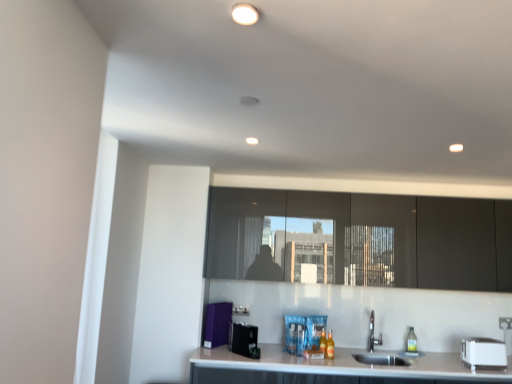
Question: Looking at their shapes, would you say matte black cabinets at center is wider or thinner than white plastic toaster at lower right, arranged as the 3th appliance when viewed from the left?

Choices:
 (A) wide
 (B) thin

Answer: (A)

Question: In terms of size, does matte black cabinets at center appear bigger or smaller than white plastic toaster at lower right, arranged as the 3th appliance when viewed from the left?

Choices:
 (A) small
 (B) big

Answer: (B)

Question: Estimate the real-world distances between objects in this image. Which object is farther from the translucent plastic bottle at lower center, the first bottle positioned from the back?

Choices:
 (A) translucent glass bottle at lower center, placed as the 1th bottle when sorted from front to back
 (B) purple fabric at lower center, marked as the third appliance in a right-to-left arrangement
 (C) black plastic coffee machine at center, positioned as the 2th appliance in right-to-left order
 (D) translucent plastic bottle at sink right
 (E) white plastic toaster at lower right, the 1th appliance when ordered from right to left

Answer: (E)

Question: Based on their relative distances, which object is farther from the black plastic coffee machine at center, positioned as the 2th appliance in right-to-left order?

Choices:
 (A) white plastic toaster at lower right, the 1th appliance when ordered from right to left
 (B) translucent plastic bottle at sink right
 (C) translucent glass bottle at lower center, the second bottle viewed from the back
 (D) matte black cabinets at center
 (E) purple fabric at lower center, which is the 1th appliance in left-to-right order

Answer: (A)